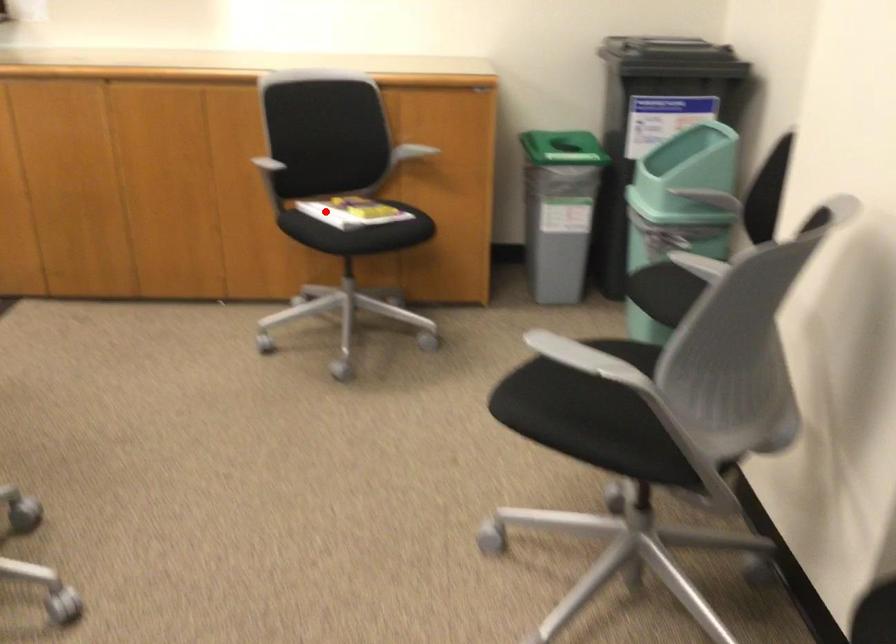
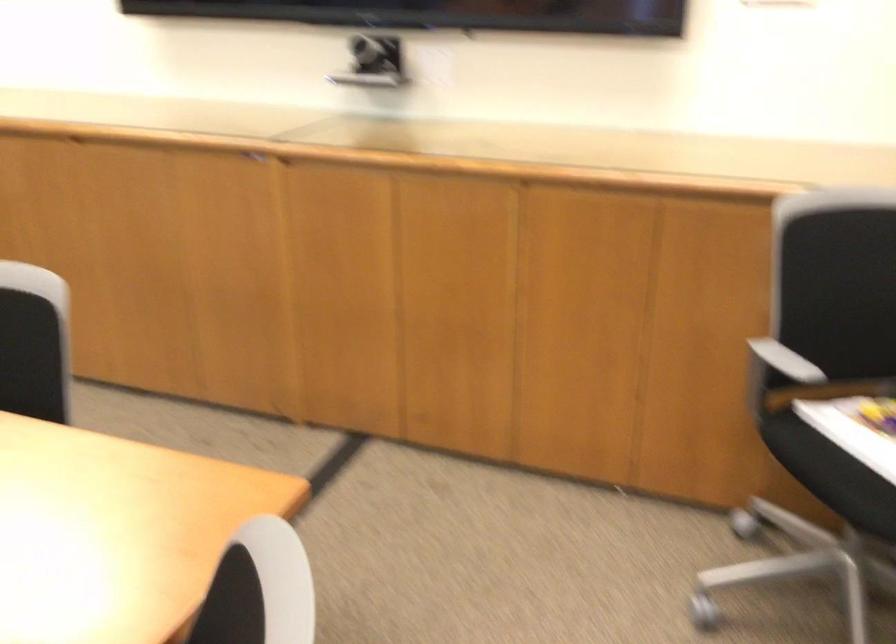
Where in the second image is the point corresponding to the highlighted location from the first image?

(857, 442)